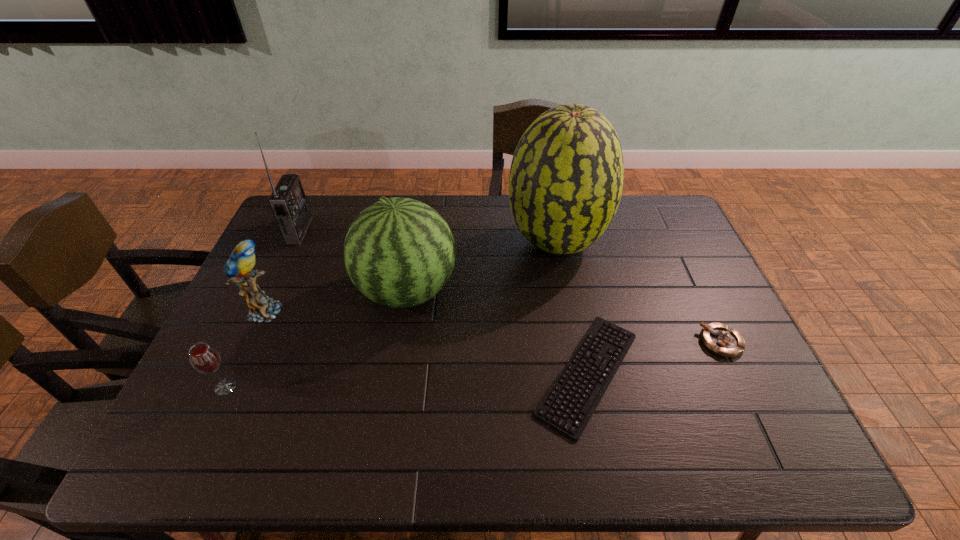
The width and height of the screenshot is (960, 540). Find the location of `radio receiver present at the left edge`. radio receiver present at the left edge is located at coordinates (288, 202).

Identify the location of parrot at the left edge. This screenshot has width=960, height=540. (238, 267).

Find the location of a particular element. wineglass situated at the left edge is located at coordinates (204, 358).

Where is `object positioned at the right edge`? object positioned at the right edge is located at coordinates (720, 339).

Find the location of `object present at the far left corner`. object present at the far left corner is located at coordinates (288, 202).

In the image, there is a desktop. Where is `vacant space at the far edge`? The height and width of the screenshot is (540, 960). vacant space at the far edge is located at coordinates (479, 206).

You are a GUI agent. You are given a task and a screenshot of the screen. Output one action in this format:
    pyautogui.click(x=<x>, y=<y>)
    Task: Click on the vacant space at the near edge of the desktop
    The width and height of the screenshot is (960, 540).
    Given the screenshot: What is the action you would take?
    pyautogui.click(x=344, y=433)

Identify the location of vacant space at the left edge. (289, 292).

This screenshot has height=540, width=960. What are the coordinates of `free spot at the right edge of the desktop` in the screenshot? It's located at (685, 306).

In the image, there is a desktop. Where is `vacant space at the far right corner`? The height and width of the screenshot is (540, 960). vacant space at the far right corner is located at coordinates (668, 234).